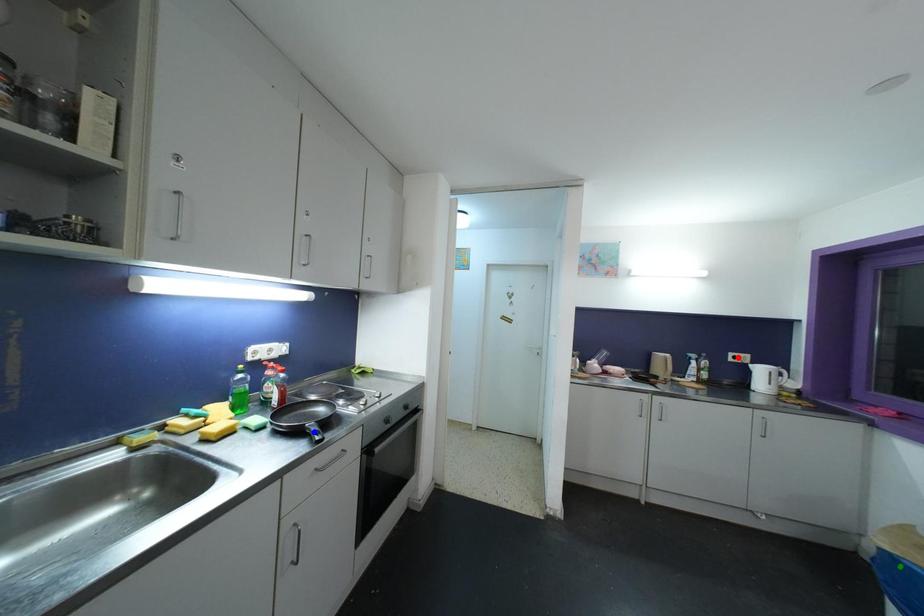
Order these from nearest to farthest:
1. green point
2. blue point
3. red point

red point
blue point
green point